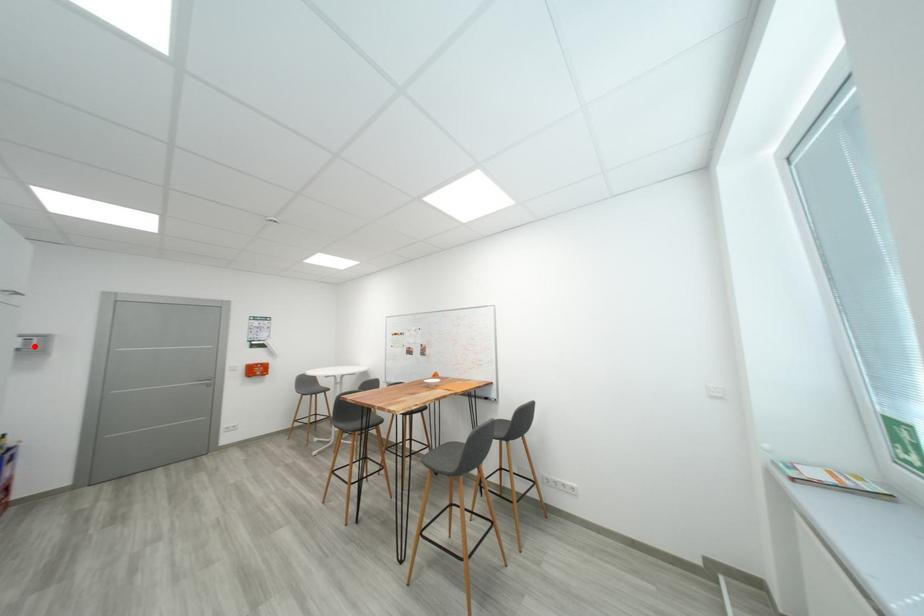
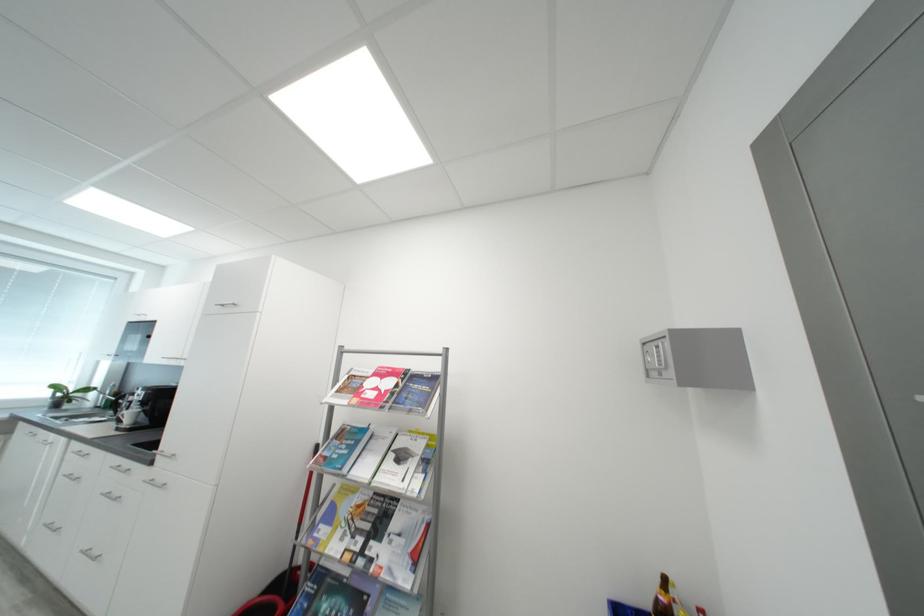
Question: I am providing you with two images of the same scene from different viewpoints. Image1 has a red point marked. In image2, the corresponding 3D location appears at what relative position? Reply with the corresponding letter.

Choices:
 (A) Closer
 (B) Farther

Answer: (B)